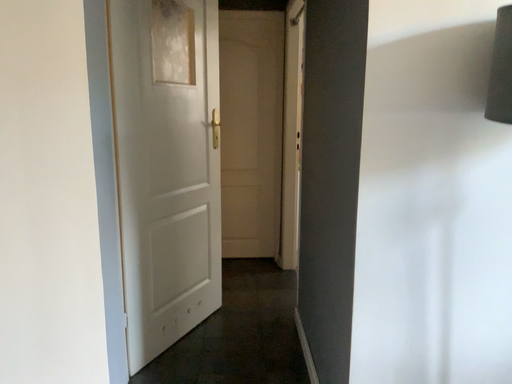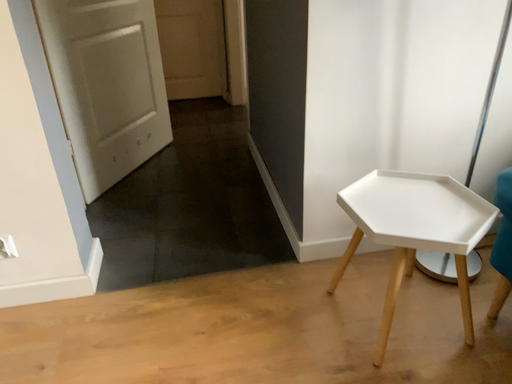
Question: How did the camera likely rotate when shooting the video?

Choices:
 (A) rotated left
 (B) rotated right

Answer: (B)